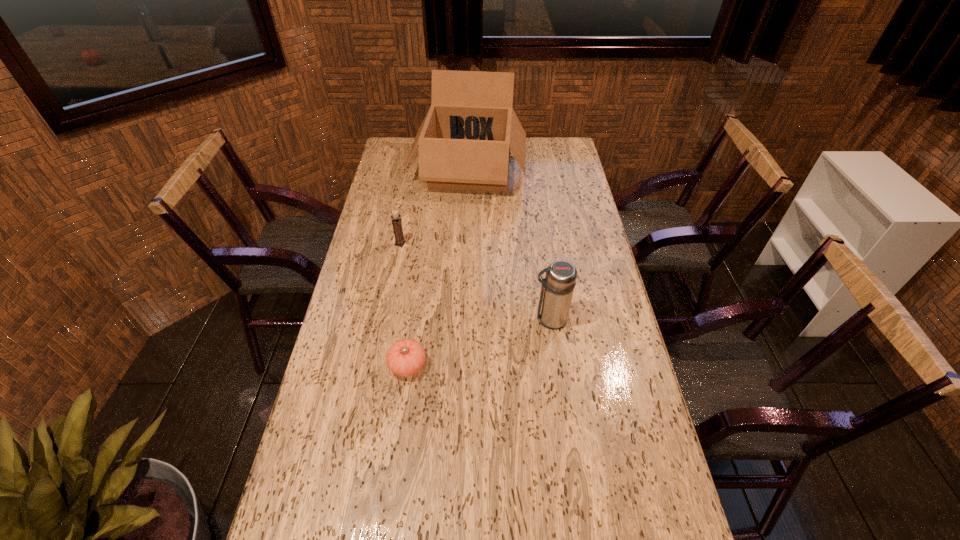
The width and height of the screenshot is (960, 540). I want to click on vacant space at the right edge of the desktop, so click(587, 286).

Where is `free region at the far left corner`? The image size is (960, 540). free region at the far left corner is located at coordinates (408, 147).

The image size is (960, 540). Find the location of `free point between the tallest object and the third farthest object`. free point between the tallest object and the third farthest object is located at coordinates (510, 245).

Where is `free space between the second nearest object and the second shortest object`? free space between the second nearest object and the second shortest object is located at coordinates (475, 281).

Image resolution: width=960 pixels, height=540 pixels. Identify the location of vacant area between the nearest object and the tallest object. (438, 268).

The image size is (960, 540). Find the location of `vacant space in between the second farthest object and the third farthest object`. vacant space in between the second farthest object and the third farthest object is located at coordinates (475, 281).

The height and width of the screenshot is (540, 960). In order to click on free space that is in between the third tallest object and the second tallest object in this screenshot , I will do `click(475, 281)`.

Locate an element on the screen. This screenshot has width=960, height=540. vacant point located between the second shortest object and the third shortest object is located at coordinates (475, 281).

Locate which object ranks in proximity to the second tallest object. Please provide its 2D coordinates. Your answer should be formatted as a tuple, i.e. [(x, y)], where the tuple contains the x and y coordinates of a point satisfying the conditions above.

[(406, 357)]

Identify which object is the second nearest to the nearest object. Please provide its 2D coordinates. Your answer should be formatted as a tuple, i.e. [(x, y)], where the tuple contains the x and y coordinates of a point satisfying the conditions above.

[(397, 226)]